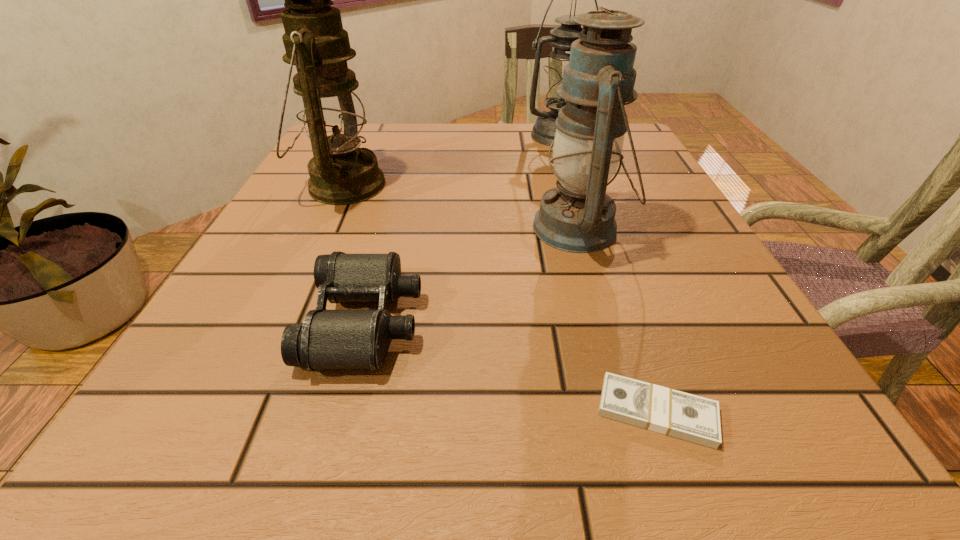
The image size is (960, 540). Identify the location of free point between the fourth tallest object and the leftmost oil lamp. (354, 253).

Locate an element on the screen. This screenshot has height=540, width=960. free space between the farthest object and the binoculars is located at coordinates (462, 228).

Identify the location of free space between the farthest object and the leftmost oil lamp. Image resolution: width=960 pixels, height=540 pixels. (450, 160).

I want to click on vacant region between the leftmost oil lamp and the farthest oil lamp, so click(x=450, y=160).

At what (x,y) coordinates should I click in order to perform the action: click on empty space between the binoculars and the leftmost oil lamp. Please return your answer as a coordinate pair (x, y). This screenshot has height=540, width=960. Looking at the image, I should click on (354, 253).

You are a GUI agent. You are given a task and a screenshot of the screen. Output one action in this format:
    pyautogui.click(x=<x>, y=<y>)
    Task: Click on the object that is the second closest one to the binoculars
    This screenshot has width=960, height=540.
    Given the screenshot: What is the action you would take?
    pyautogui.click(x=577, y=216)

Choose which object is the fourth nearest neighbor to the binoculars. Please provide its 2D coordinates. Your answer should be formatted as a tuple, i.e. [(x, y)], where the tuple contains the x and y coordinates of a point satisfying the conditions above.

[(561, 38)]

At what (x,y) coordinates should I click in order to perform the action: click on oil lamp that stands as the closest to the fourth tallest object. Please return your answer as a coordinate pair (x, y). Looking at the image, I should click on (329, 103).

Choose which oil lamp is the nearest neighbor to the binoculars. Please provide its 2D coordinates. Your answer should be formatted as a tuple, i.e. [(x, y)], where the tuple contains the x and y coordinates of a point satisfying the conditions above.

[(329, 103)]

Where is `blank area in the image that satisfies the following two spatial constraints: 1. through the eyepieces of the shortest object; 2. on the right side of the binoculars`? blank area in the image that satisfies the following two spatial constraints: 1. through the eyepieces of the shortest object; 2. on the right side of the binoculars is located at coordinates (341, 411).